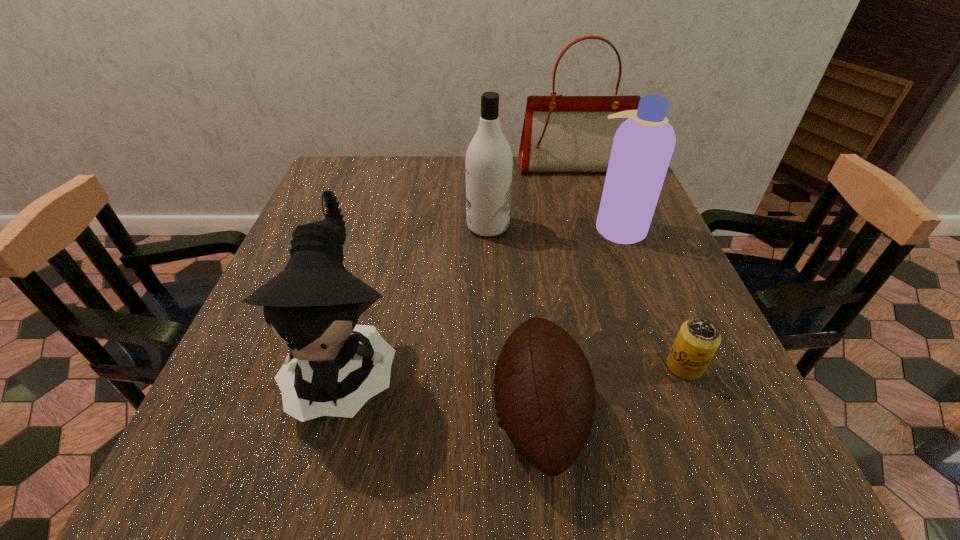
You are a GUI agent. You are given a task and a screenshot of the screen. Output one action in this format:
    pyautogui.click(x=<x>, y=<y>)
    Task: Click on the vacant area that lies between the football and the right shampoo
    
    Given the screenshot: What is the action you would take?
    pyautogui.click(x=579, y=320)

Identify the location of empty space that is in between the second shortest object and the left shampoo. The image size is (960, 540). click(514, 320).

Identify the location of vacant space that is in between the shortest object and the farthest object. Image resolution: width=960 pixels, height=540 pixels. (629, 267).

Locate an element on the screen. The image size is (960, 540). empty location between the right shampoo and the farthest object is located at coordinates (595, 197).

What are the coordinates of `free space between the fifth tallest object and the beer can` in the screenshot? It's located at (612, 390).

Where is `vacant area between the left shampoo and the beer can`? vacant area between the left shampoo and the beer can is located at coordinates (587, 296).

This screenshot has width=960, height=540. What are the coordinates of `vacant point located between the farthest object and the beer can` in the screenshot? It's located at (629, 267).

What are the coordinates of `empty space between the handbag and the leftmost object` in the screenshot? It's located at (460, 266).

Point out which object is positioned as the nearest to the football. Please provide its 2D coordinates. Your answer should be formatted as a tuple, i.e. [(x, y)], where the tuple contains the x and y coordinates of a point satisfying the conditions above.

[(698, 339)]

Image resolution: width=960 pixels, height=540 pixels. What are the coordinates of `object that ranks as the third closest to the fifth tallest object` in the screenshot? It's located at (643, 145).